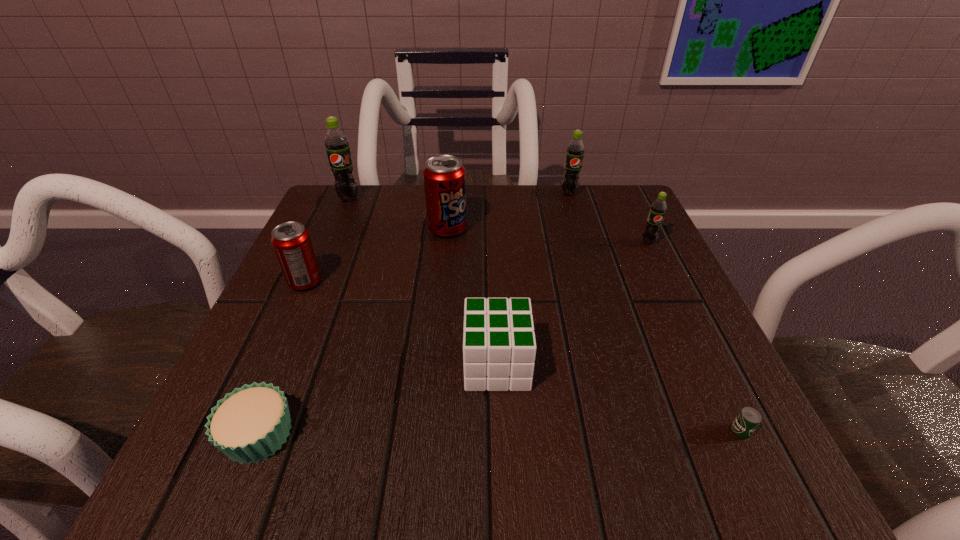
Identify the location of object positioned at the near right corner. coord(748,419).

The height and width of the screenshot is (540, 960). I want to click on vacant space at the far edge, so click(462, 240).

Where is `vacant region at the near edge of the desktop`? Image resolution: width=960 pixels, height=540 pixels. vacant region at the near edge of the desktop is located at coordinates (563, 453).

Locate an element on the screen. This screenshot has height=540, width=960. vacant space at the left edge is located at coordinates (351, 283).

This screenshot has width=960, height=540. What are the coordinates of `free space at the right edge of the desktop` in the screenshot? It's located at (641, 354).

The image size is (960, 540). Find the location of `free space at the far right corner of the desktop`. free space at the far right corner of the desktop is located at coordinates (587, 190).

Find the location of a particular element. This screenshot has width=960, height=540. vacant space at the near right corner of the desktop is located at coordinates (699, 440).

Image resolution: width=960 pixels, height=540 pixels. Identify the location of vacant area that lies between the nearest green soda and the tallest soda can. (498, 221).

Where is `vacant region between the sixth object from left to right and the beer can`? This screenshot has height=540, width=960. vacant region between the sixth object from left to right and the beer can is located at coordinates (655, 312).

This screenshot has width=960, height=540. Identify the location of free space between the second green soda from right to left and the fourth nearest object. (437, 238).